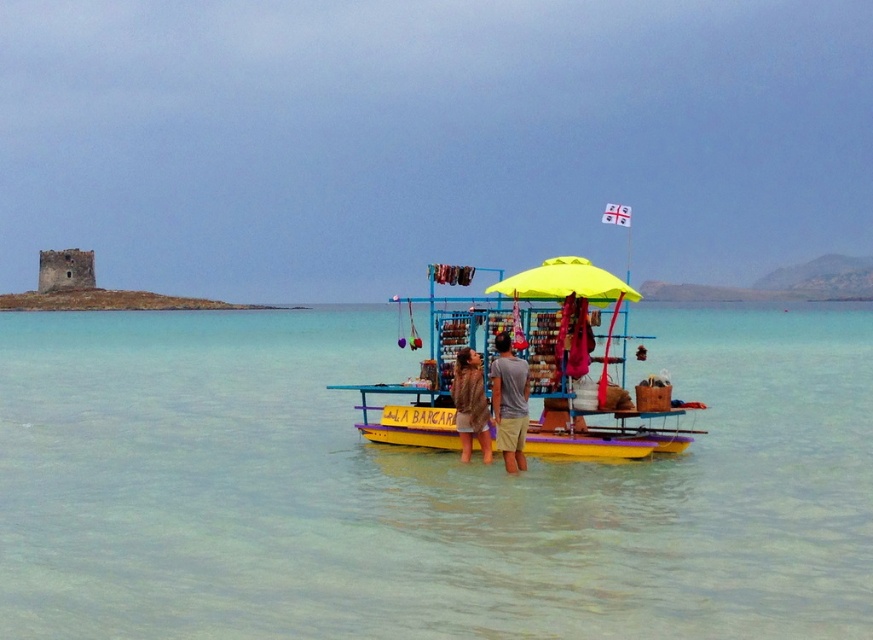
Can you confirm if yellow wooden boat at center is shorter than brown fur coat at center?

In fact, yellow wooden boat at center may be taller than brown fur coat at center.

Is the position of yellow wooden boat at center less distant than that of brown fur coat at center?

Yes.

Describe the element at coordinates (528, 369) in the screenshot. I see `yellow wooden boat at center` at that location.

You are a GUI agent. You are given a task and a screenshot of the screen. Output one action in this format:
    pyautogui.click(x=<x>, y=<y>)
    Task: Click on the yellow wooden boat at center
    This screenshot has width=873, height=640.
    Given the screenshot: What is the action you would take?
    pyautogui.click(x=528, y=369)

Can you confirm if yellow wooden boat at center is shorter than yellow fabric umbrella at center?

Indeed, yellow wooden boat at center has a lesser height compared to yellow fabric umbrella at center.

Is yellow wooden boat at center to the right of yellow fabric umbrella at center from the viewer's perspective?

In fact, yellow wooden boat at center is to the left of yellow fabric umbrella at center.

Which is behind, point (582, 355) or point (564, 275)?

Positioned behind is point (564, 275).

Where is `yellow wooden boat at center`? This screenshot has width=873, height=640. yellow wooden boat at center is located at coordinates (528, 369).

Is point (545, 264) positioned after point (510, 401)?

Yes, it is behind point (510, 401).

Is yellow fabric umbrella at center shorter than light brown cotton shorts at center?

Incorrect, yellow fabric umbrella at center's height does not fall short of light brown cotton shorts at center's.

Does point (605, 301) lie in front of point (509, 346)?

No.

In order to click on yellow fabric umbrella at center in this screenshot , I will do `click(565, 282)`.